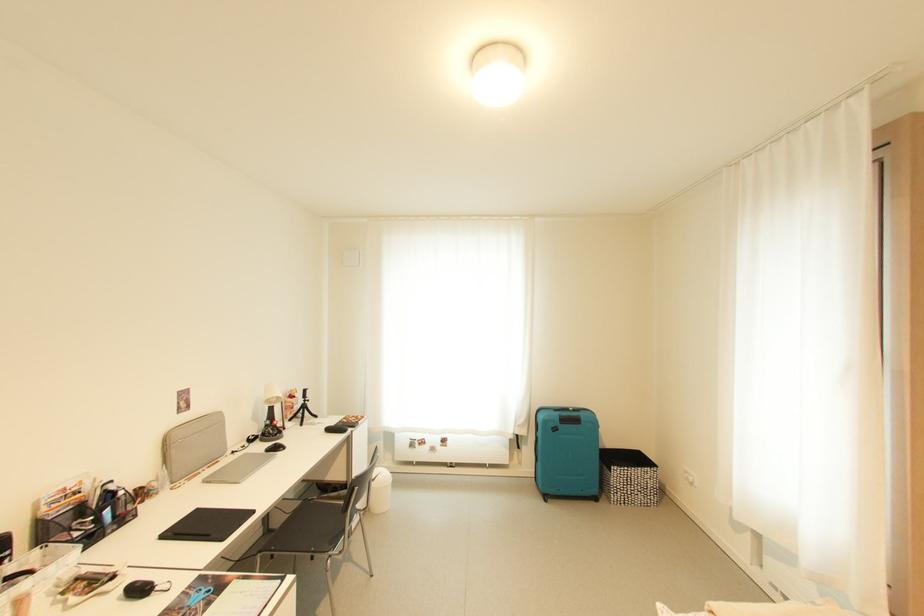
The height and width of the screenshot is (616, 924). I want to click on white desk lamp, so click(271, 414).